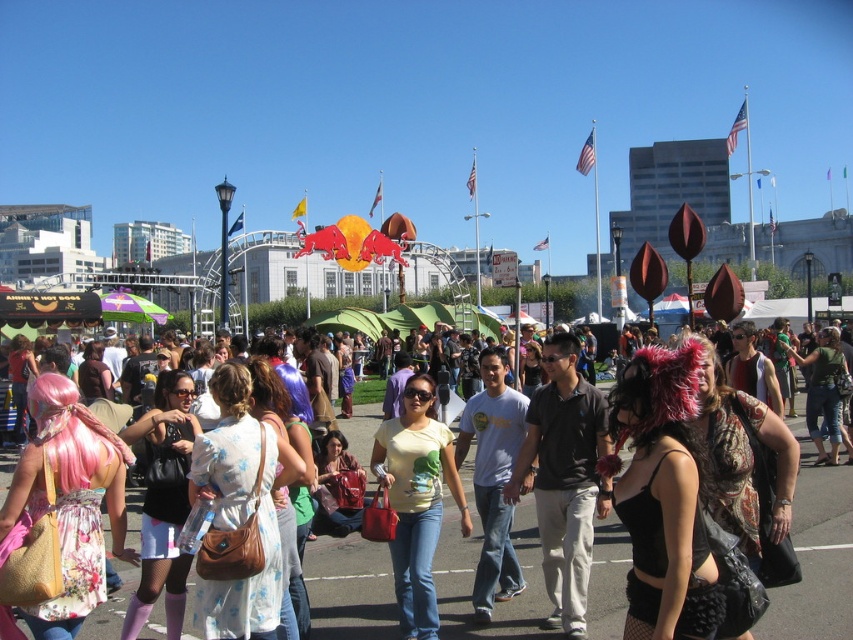
Question: Which point is farther from the camera taking this photo?

Choices:
 (A) (431, 525)
 (B) (544, 445)
 (C) (357, 624)

Answer: (B)

Question: Can you confirm if floral dress at center is wider than yellow matte shirt at center?

Choices:
 (A) no
 (B) yes

Answer: (B)

Question: Is floral dress at center to the left of dark gray polo shirt at center from the viewer's perspective?

Choices:
 (A) no
 (B) yes

Answer: (B)

Question: Which of the following is the closest to the observer?

Choices:
 (A) [325, 592]
 (B) [527, 442]
 (C) [437, 474]

Answer: (A)

Question: Is floral dress at center in front of yellow matte shirt at center?

Choices:
 (A) no
 (B) yes

Answer: (B)

Question: Which point is closer to the camera?

Choices:
 (A) floral dress at center
 (B) dark gray polo shirt at center
 (C) yellow matte shirt at center

Answer: (A)